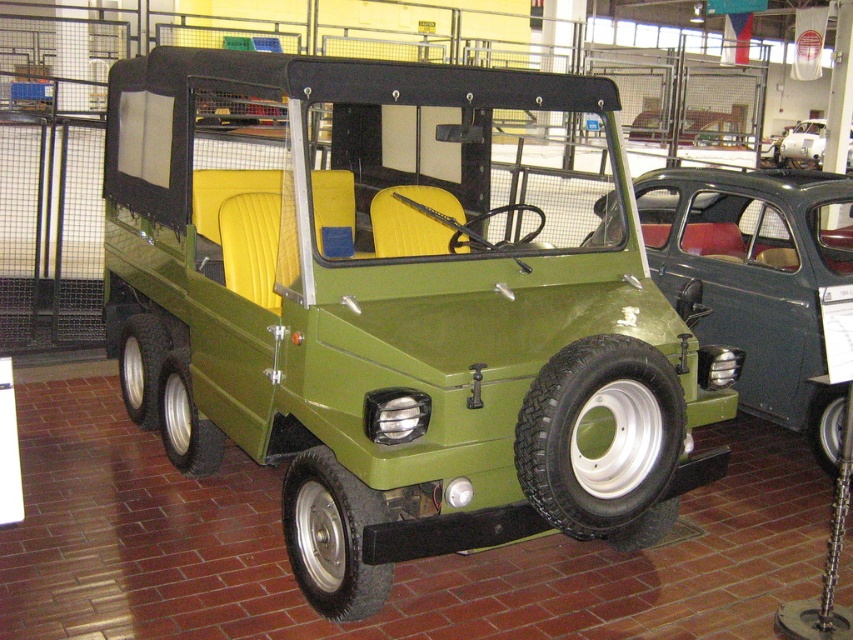
Question: Based on their relative distances, which object is farther from the green matte truck at center?

Choices:
 (A) green matte pickup truck at center
 (B) metallic silver car at center

Answer: (B)

Question: Which object is the closest to the metallic silver car at center?

Choices:
 (A) green matte truck at center
 (B) green matte pickup truck at center

Answer: (A)

Question: Can you confirm if green matte pickup truck at center is bigger than green matte truck at center?

Choices:
 (A) yes
 (B) no

Answer: (B)

Question: Can you confirm if green matte pickup truck at center is wider than green matte truck at center?

Choices:
 (A) no
 (B) yes

Answer: (A)

Question: Can you confirm if green matte truck at center is positioned to the left of metallic silver car at center?

Choices:
 (A) yes
 (B) no

Answer: (A)

Question: Which object is farther from the camera taking this photo?

Choices:
 (A) metallic silver car at center
 (B) green matte truck at center
 (C) green matte pickup truck at center

Answer: (A)